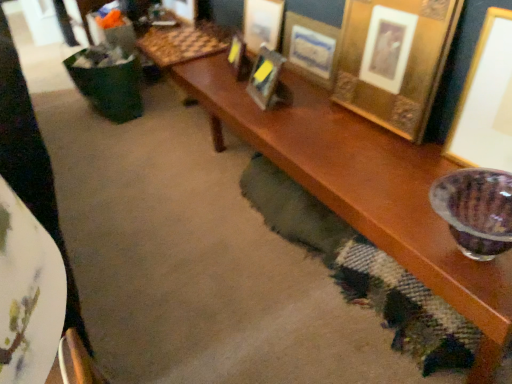
Question: In terms of width, does white fabric at lower left look wider or thinner when compared to gold textured picture frame at upper right, the second picture frame from the right?

Choices:
 (A) wide
 (B) thin

Answer: (A)

Question: In terms of height, does white fabric at lower left look taller or shorter compared to gold textured picture frame at upper right, which appears as the fifth picture frame when viewed from the left?

Choices:
 (A) short
 (B) tall

Answer: (A)

Question: Based on their relative distances, which object is nearer to the gold metallic picture frame at upper right, which ranks as the 6th picture frame in left-to-right order?

Choices:
 (A) gold metallic picture frame at upper right, which appears as the 3th picture frame when viewed from the right
 (B) gold metallic picture frame at upper center, the 4th picture frame in the right-to-left sequence
 (C) gold textured picture frame at upper right, the second picture frame from the right
 (D) white fabric at lower left
 (E) gold metallic picture frame at upper center, arranged as the second picture frame when viewed from the left

Answer: (C)

Question: Which object is positioned farthest from the gold metallic picture frame at upper right, which ranks as the 6th picture frame in left-to-right order?

Choices:
 (A) white fabric at lower left
 (B) gold metallic picture frame at upper center, the 1th picture frame when ordered from left to right
 (C) gold metallic picture frame at upper center, the 4th picture frame in the right-to-left sequence
 (D) gold metallic picture frame at upper right, which appears as the 4th picture frame when viewed from the left
 (E) gold textured picture frame at upper right, which appears as the fifth picture frame when viewed from the left

Answer: (A)